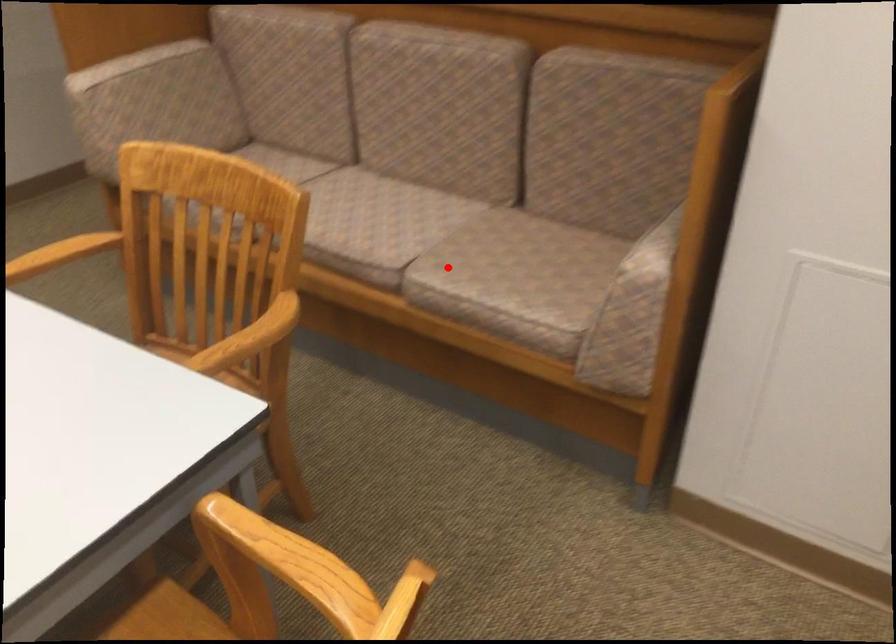
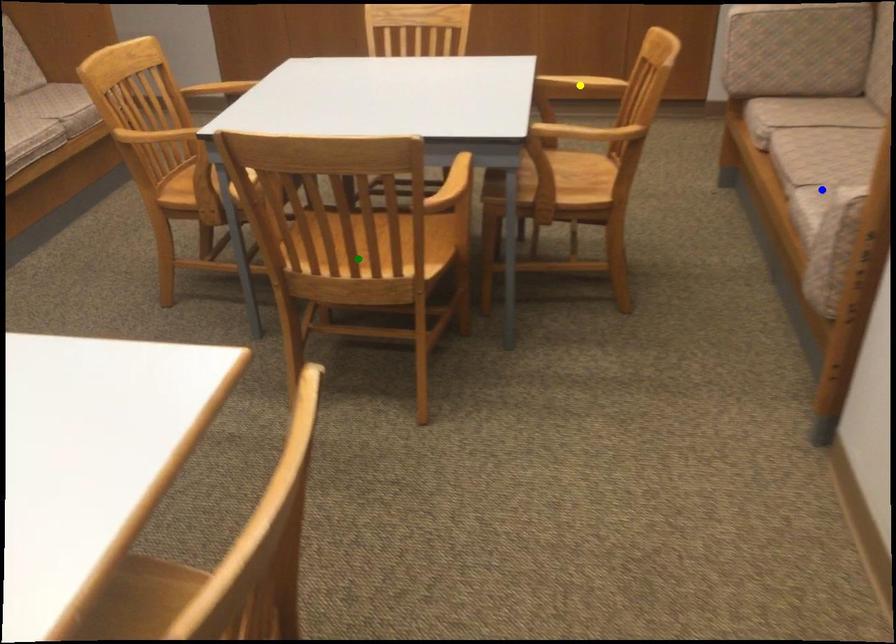
Question: I am providing you with two images of the same scene from different viewpoints. A red point is marked on the first image. You are given multiple points on the second image. Can you choose the point in image 2 that corresponds to the point in image 1?

Choices:
 (A) green point
 (B) yellow point
 (C) blue point

Answer: (C)